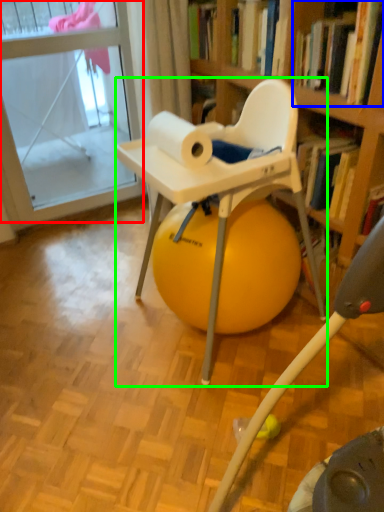
Question: Which object is the closest to the glass door (highlighted by a red box)? Choose among these: book (highlighted by a blue box) or chair (highlighted by a green box).

Choices:
 (A) book
 (B) chair

Answer: (B)